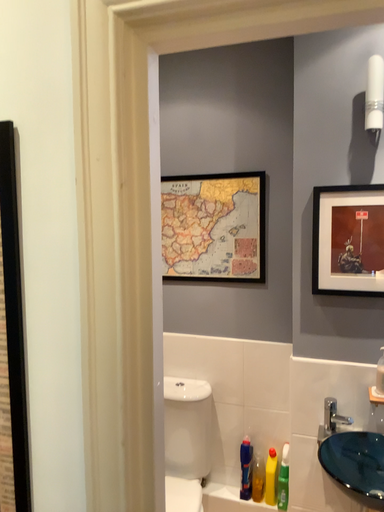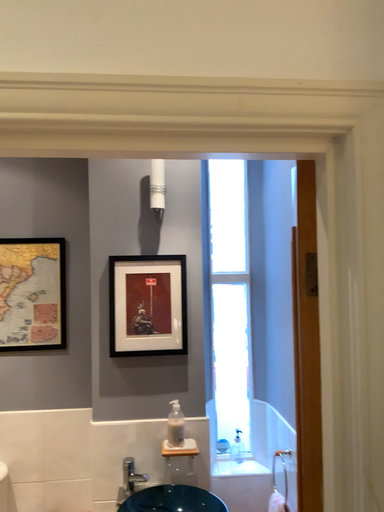
Question: Which way did the camera rotate in the video?

Choices:
 (A) rotated downward
 (B) rotated upward

Answer: (B)